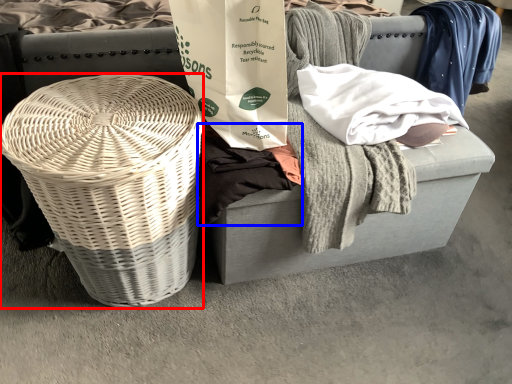
Question: Which of the following is the closest to the observer, basket (highlighted by a red box) or clothing (highlighted by a blue box)?

Choices:
 (A) basket
 (B) clothing

Answer: (A)